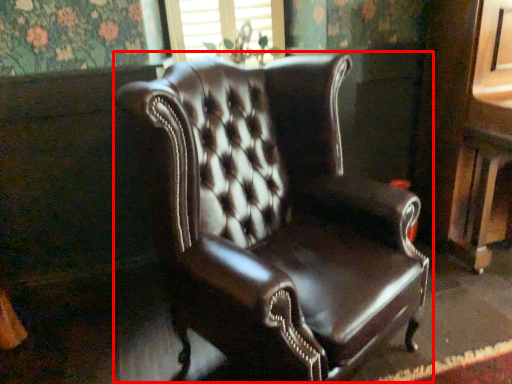
Question: From the image's perspective, where is chair (annotated by the red box) located relative to window frame?

Choices:
 (A) above
 (B) below

Answer: (B)